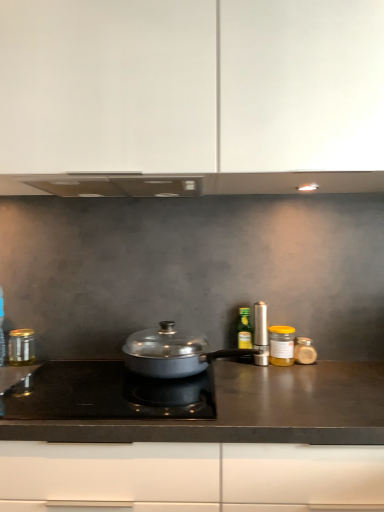
In order to click on vacant space that's between matte silver pan at center, which appears as the second kitchen appliance when viewed from the left, and yellow glass jar at right, the 5th kitchen appliance positioned from the left in this screenshot , I will do `click(276, 371)`.